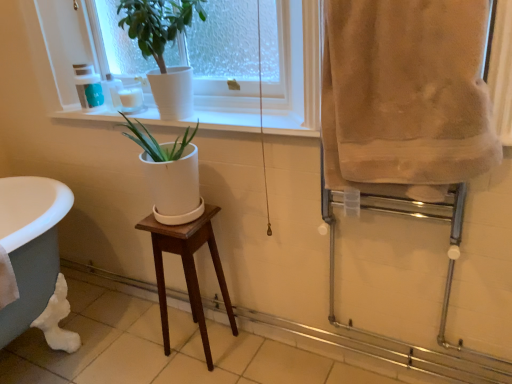
Measure the distance between point (x=405, y=194) and camera.

Point (x=405, y=194) and camera are 3.63 feet apart.

The image size is (512, 384). What are the coordinates of `white ceramic at upper center` in the screenshot? It's located at (210, 114).

The image size is (512, 384). What do you see at coordinates (210, 114) in the screenshot?
I see `white ceramic at upper center` at bounding box center [210, 114].

Measure the distance between point (183, 261) and camera.

They are 5.86 feet apart.

Image resolution: width=512 pixels, height=384 pixels. In order to click on white ceramic pot at upper center in this screenshot , I will do `click(154, 62)`.

From a real-world perspective, is mahogany wood stool at center below white ceramic pot at upper center?

Correct, in the physical world, mahogany wood stool at center is lower than white ceramic pot at upper center.

Which point is more forward, (203, 341) or (296, 21)?

Positioned in front is point (296, 21).

Looking at the image, does mahogany wood stool at center seem bigger or smaller compared to white ceramic pot at upper center?

Considering their sizes, mahogany wood stool at center takes up less space than white ceramic pot at upper center.

Is mahogany wood stool at center in front of white ceramic pot at upper center?

No, the depth of mahogany wood stool at center is greater than that of white ceramic pot at upper center.

Where is `the 2nd toiletry behind the beige soft towel at right, counting from the anchor's position`? The height and width of the screenshot is (384, 512). the 2nd toiletry behind the beige soft towel at right, counting from the anchor's position is located at coordinates (88, 86).

Which of these two, beige soft towel at right or matte green plastic cup at upper left, the first toiletry positioned from the left, is smaller?

With smaller size is matte green plastic cup at upper left, the first toiletry positioned from the left.

Considering the relative positions of beige soft towel at right and matte green plastic cup at upper left, the first toiletry positioned from the left, in the image provided, is beige soft towel at right to the left of matte green plastic cup at upper left, the first toiletry positioned from the left, from the viewer's perspective?

Incorrect, beige soft towel at right is not on the left side of matte green plastic cup at upper left, the first toiletry positioned from the left.

Is the surface of mahogany wood stool at center in direct contact with white glossy candle at upper left, which ranks as the first toiletry in right-to-left order?

There is a gap between mahogany wood stool at center and white glossy candle at upper left, which ranks as the first toiletry in right-to-left order.

From the image's perspective, is mahogany wood stool at center located above or below white glossy candle at upper left, which ranks as the first toiletry in right-to-left order?

From the image's perspective, mahogany wood stool at center appears below white glossy candle at upper left, which ranks as the first toiletry in right-to-left order.

In terms of width, does mahogany wood stool at center look wider or thinner when compared to white glossy candle at upper left, the 2th toiletry in the left-to-right sequence?

Clearly, mahogany wood stool at center has more width compared to white glossy candle at upper left, the 2th toiletry in the left-to-right sequence.

Where is `the 1st toiletry above the mahogany wood stool at center (from the image's perspective)`? the 1st toiletry above the mahogany wood stool at center (from the image's perspective) is located at coordinates (131, 96).

Would you consider mahogany wood stool at center to be distant from white ceramic at upper center?

Actually, mahogany wood stool at center and white ceramic at upper center are a little close together.

Which is behind, point (201, 337) or point (284, 131)?

Point (201, 337)

At what (x,y) coordinates should I click in order to perform the action: click on window sill above the mahogany wood stool at center (from a real-world perspective). Please return your answer as a coordinate pair (x, y). Looking at the image, I should click on (210, 114).

Looking at this image, does mahogany wood stool at center have a greater width compared to white ceramic at upper center?

Indeed, mahogany wood stool at center has a greater width compared to white ceramic at upper center.

From the image's perspective, which object appears higher, beige soft towel at right or mahogany wood stool at center?

beige soft towel at right, from the image's perspective.

In order to click on stool below the beige soft towel at right (from the image's perspective) in this screenshot , I will do `click(187, 268)`.

Based on their sizes in the image, would you say beige soft towel at right is bigger or smaller than mahogany wood stool at center?

In the image, beige soft towel at right appears to be larger than mahogany wood stool at center.

Is beige soft towel at right further to the viewer compared to mahogany wood stool at center?

No, beige soft towel at right is closer to the camera.

Based on the photo, does white ceramic at upper center have a lesser width compared to white ceramic pot at upper center?

Indeed, white ceramic at upper center has a lesser width compared to white ceramic pot at upper center.

Considering the positions of points (236, 104) and (196, 26), is point (236, 104) closer to camera compared to point (196, 26)?

That is False.

From their relative heights in the image, would you say white ceramic at upper center is taller or shorter than white ceramic pot at upper center?

white ceramic at upper center is shorter than white ceramic pot at upper center.

Considering the relative sizes of white ceramic at upper center and white ceramic pot at upper center in the image provided, is white ceramic at upper center smaller than white ceramic pot at upper center?

Correct, white ceramic at upper center occupies less space than white ceramic pot at upper center.

Does white ceramic pot at upper center have a larger size compared to white ceramic at upper center?

Indeed, white ceramic pot at upper center has a larger size compared to white ceramic at upper center.

Looking at this image, from the image's perspective, is white ceramic pot at upper center under white ceramic at upper center?

Actually, white ceramic pot at upper center appears above white ceramic at upper center in the image.

Find the location of a particular element. This screenshot has height=384, width=512. window sill located below the white ceramic pot at upper center (from the image's perspective) is located at coordinates (210, 114).

In the image, is white ceramic pot at upper center on the left side or the right side of white ceramic at upper center?

In the image, white ceramic pot at upper center appears on the left side of white ceramic at upper center.

At what (x,y) coordinates should I click in order to perform the action: click on stool on the right of white ceramic pot at upper center. Please return your answer as a coordinate pair (x, y). This screenshot has width=512, height=384. Looking at the image, I should click on (187, 268).

You are a GUI agent. You are given a task and a screenshot of the screen. Output one action in this format:
    pyautogui.click(x=<x>, y=<y>)
    Task: Click on the bath towel in front of the matte green plastic cup at upper left, placed as the 2th toiletry when sorted from right to left
    Image resolution: width=512 pixels, height=384 pixels.
    Given the screenshot: What is the action you would take?
    405,96

Consider the image. Considering their positions, is white glossy candle at upper left, which ranks as the first toiletry in right-to-left order, positioned further to white ceramic at upper center than beige soft towel at right?

beige soft towel at right.

Looking at the image, which one is located further to white ceramic at upper center, beige soft towel at right or white ceramic pot at upper center?

beige soft towel at right lies further to white ceramic at upper center than the other object.

Considering their positions, is matte green plastic cup at upper left, placed as the 2th toiletry when sorted from right to left, positioned closer to white ceramic pot at upper center than white ceramic at upper center?

white ceramic at upper center.

From the image, which object appears to be farther from white glossy candle at upper left, the 2th toiletry in the left-to-right sequence, matte green plastic cup at upper left, placed as the 2th toiletry when sorted from right to left, or mahogany wood stool at center?

mahogany wood stool at center.

From the image, which object appears to be nearer to white ceramic pot at upper center, matte green plastic cup at upper left, placed as the 2th toiletry when sorted from right to left, or white glossy candle at upper left, the 2th toiletry in the left-to-right sequence?

white glossy candle at upper left, the 2th toiletry in the left-to-right sequence.

Consider the image. Based on their spatial positions, is white ceramic pot at upper center or beige soft towel at right further from white glossy candle at upper left, which ranks as the first toiletry in right-to-left order?

beige soft towel at right lies further to white glossy candle at upper left, which ranks as the first toiletry in right-to-left order, than the other object.

Based on their spatial positions, is white glossy candle at upper left, the 2th toiletry in the left-to-right sequence, or matte green plastic cup at upper left, the first toiletry positioned from the left, closer to mahogany wood stool at center?

white glossy candle at upper left, the 2th toiletry in the left-to-right sequence, lies closer to mahogany wood stool at center than the other object.

Looking at the image, which one is located further to beige soft towel at right, white ceramic at upper center or mahogany wood stool at center?

Among the two, mahogany wood stool at center is located further to beige soft towel at right.

At what (x,y) coordinates should I click in order to perform the action: click on window sill between white ceramic pot at upper center and matte green plastic cup at upper left, placed as the 2th toiletry when sorted from right to left, along the z-axis. Please return your answer as a coordinate pair (x, y). The image size is (512, 384). Looking at the image, I should click on (210, 114).

You are a GUI agent. You are given a task and a screenshot of the screen. Output one action in this format:
    pyautogui.click(x=<x>, y=<y>)
    Task: Click on the stool between matte green plastic cup at upper left, placed as the 2th toiletry when sorted from right to left, and beige soft towel at right, in the horizontal direction
    This screenshot has width=512, height=384.
    Given the screenshot: What is the action you would take?
    pyautogui.click(x=187, y=268)

Find the location of `toiletry located between white ceramic at upper center and matte green plastic cup at upper left, the first toiletry positioned from the left, in the depth direction`. toiletry located between white ceramic at upper center and matte green plastic cup at upper left, the first toiletry positioned from the left, in the depth direction is located at coordinates (131, 96).

Find the location of a particular element. This screenshot has width=512, height=384. toiletry between matte green plastic cup at upper left, placed as the 2th toiletry when sorted from right to left, and beige soft towel at right from left to right is located at coordinates (131, 96).